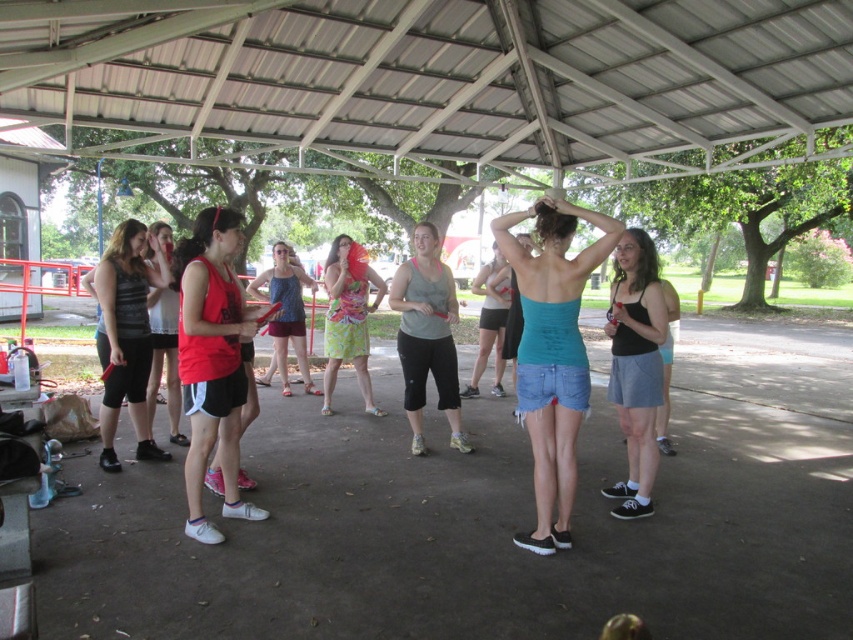
You are organizing a photo shoot and need to place two models wearing the gray matte tank top at center and the lime green floral dress at center in a way that maintains their relative sizes as seen in the original image. How should you position them to ensure the size relationship remains accurate?

To maintain the size relationship between the gray matte tank top at center and the lime green floral dress at center, the gray matte tank top at center should be placed closer to the camera than the lime green floral dress at center, as it appears smaller in the original image.

You are a photographer trying to capture a group photo of the black tank top at center and the blue tank top at center. Which one should you focus on first if you want to ensure the taller person is in focus?

The black tank top at center is taller than the blue tank top at center, so you should focus on the black tank top at center first to ensure the taller person is in focus.

Looking at this image, you are standing in the park and looking at the group under the pavilion. You notice two points marked in the image. Which point, point [442,268] or point [369,282], is closer to you?

Point [442,268] is closer to you because it is closer to the camera than point [369,282].